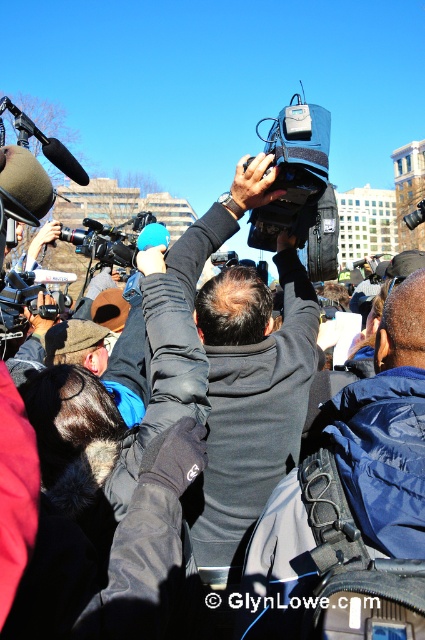
You are a photographer at the event and need to choose between the black matte video camera at upper center and the black plastic video camera at upper left for a quick shot. Which camera is wider?

The black matte video camera at upper center is wider than the black plastic video camera at upper left.

You are a photographer at the event and need to adjust your equipment. Which of the two cameras, the black matte video camera at upper center or the black plastic video camera at upper left, is positioned closer to you?

The black matte video camera at upper center is closer to the viewer than the black plastic video camera at upper left.